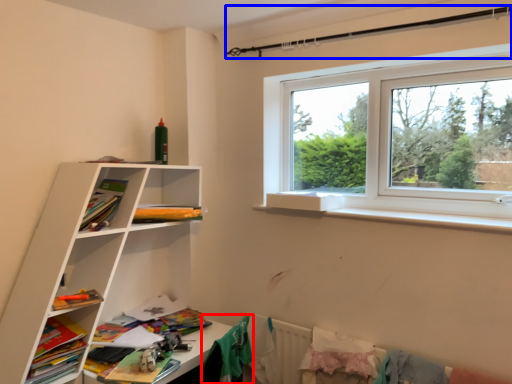
Question: Among these objects, which one is farthest to the camera, clothing (highlighted by a red box) or clothesline (highlighted by a blue box)?

Choices:
 (A) clothing
 (B) clothesline

Answer: (A)